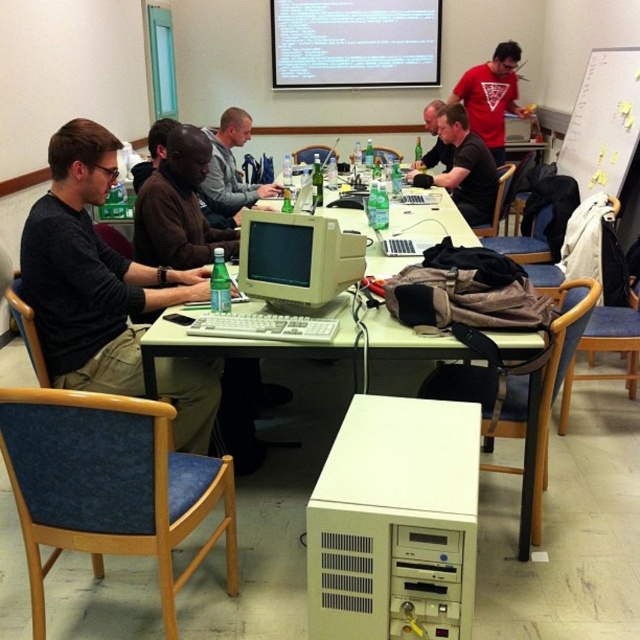
Who is lower down, matte red t-shirt at upper center or matte black shirt at center?

Positioned lower is matte black shirt at center.

Can you confirm if matte red t-shirt at upper center is taller than matte black shirt at center?

Correct, matte red t-shirt at upper center is much taller as matte black shirt at center.

Find the location of a particular element. This screenshot has height=640, width=640. matte red t-shirt at upper center is located at coordinates (490, 97).

Identify the location of matte red t-shirt at upper center. This screenshot has width=640, height=640. (490, 97).

Measure the distance from white plastic table at center to matte red t-shirt at upper center.

white plastic table at center is 4.27 meters from matte red t-shirt at upper center.

Who is more forward, (x=384, y=324) or (x=490, y=148)?

Point (x=384, y=324) is more forward.

Where is `white plastic table at center`? This screenshot has height=640, width=640. white plastic table at center is located at coordinates (228, 346).

Which of these two, white plastic desktop computer at lower center or matte black shirt at center, stands shorter?

With less height is white plastic desktop computer at lower center.

The image size is (640, 640). I want to click on white plastic desktop computer at lower center, so click(x=396, y=522).